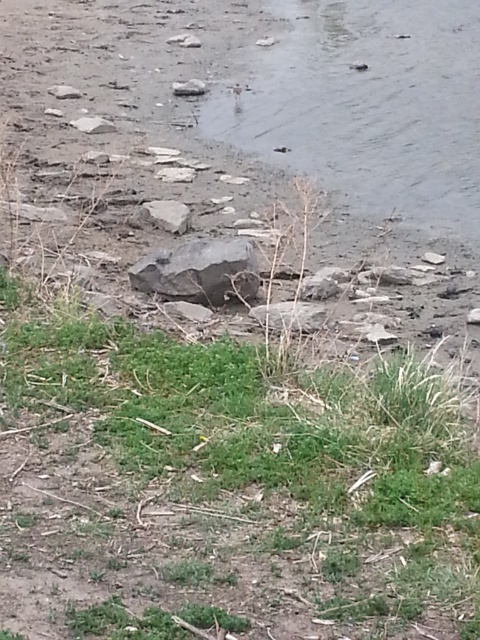
You are standing in the natural scene described. You see the green grass at lower center and the gray rough rock at center. Which object is closer to you?

The green grass at lower center is closer to you because it is positioned in front of the gray rough rock at center.

You are a gardener trying to plant a new flower. You have a small shovel that can dig up to 15 cm deep. You see the green grass at lower center and the gray rough rock at center. Which area would be easier to dig with your shovel?

The green grass at lower center would be easier to dig with the shovel since the gray rough rock at center is harder and more solid, making it difficult to dig to the required depth.

You are standing on the grassy area and want to cross to the rocky terrain. You see the gray rough rock at center and the gray rough stone at center. Which one is to your right when facing the rocks?

The gray rough rock at center is positioned on the right side of gray rough stone at center, so when facing the rocks, the gray rough rock at center will be to your right.